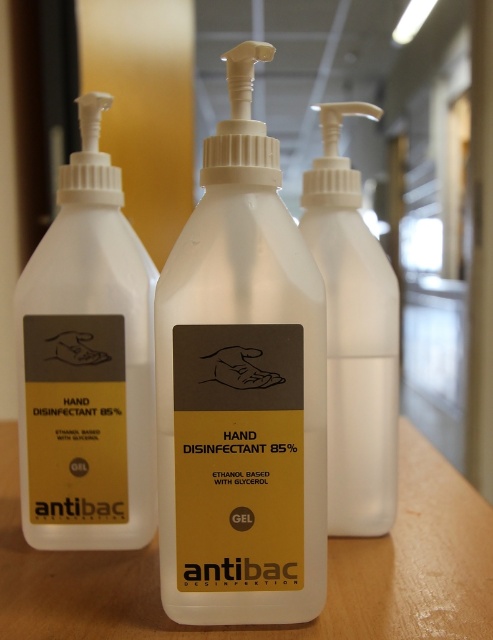
You are a delivery person who needs to place a new bottle between the two existing points in the image. The new bottle must be placed exactly halfway between point (x=164, y=515) and point (x=57, y=385). What are the coordinates of the spot where you should place the new bottle?

The coordinates of the spot to place the new bottle would be the midpoint between point (x=164, y=515) and point (x=57, y=385). To calculate this, average the x and y coordinates separately. The midpoint is at x coordinate 0.704 and y coordinate 0.225. Therefore, the coordinates are approximately 0.704, 0.225.

You need to place a 10 cm wide box between the matte white hand sanitizer at left and the white plastic hand sanitizer at center. Given their widths, will there be enough space for the box?

The matte white hand sanitizer at left is wider than the white plastic hand sanitizer at center. However, the total width of both bottles combined would determine if there is enough space. Since the exact widths aren

You are looking at three white plastic bottles with pump dispensers on a wooden surface. You notice two points marked on the image at coordinates point (87, 273) and point (377, 433). Which of these points is located closer to the camera?

Point (87, 273) is closer to the camera than point 0.675, 0.765.